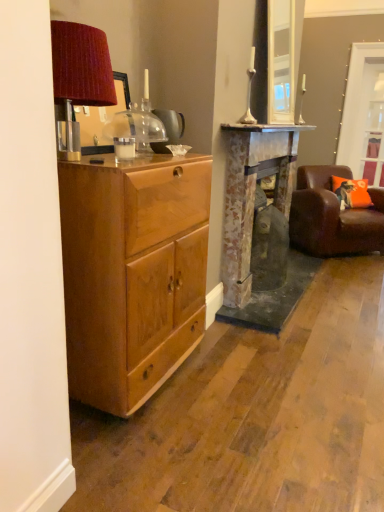
Question: Would you consider rustic stone fireplace at center to be distant from clear glass door at upper right?

Choices:
 (A) no
 (B) yes

Answer: (B)

Question: Does rustic stone fireplace at center lie behind clear glass door at upper right?

Choices:
 (A) no
 (B) yes

Answer: (A)

Question: Considering the relative sizes of rustic stone fireplace at center and clear glass door at upper right in the image provided, is rustic stone fireplace at center thinner than clear glass door at upper right?

Choices:
 (A) yes
 (B) no

Answer: (B)

Question: From the image's perspective, would you say rustic stone fireplace at center is shown under clear glass door at upper right?

Choices:
 (A) no
 (B) yes

Answer: (B)

Question: Is rustic stone fireplace at center next to clear glass door at upper right?

Choices:
 (A) yes
 (B) no

Answer: (B)

Question: From the image's perspective, is clear glass door at upper right located above or below brown leather chair at right?

Choices:
 (A) below
 (B) above

Answer: (B)

Question: Looking at their shapes, would you say clear glass door at upper right is wider or thinner than brown leather chair at right?

Choices:
 (A) thin
 (B) wide

Answer: (A)

Question: Which is correct: clear glass door at upper right is inside brown leather chair at right, or outside of it?

Choices:
 (A) outside
 (B) inside

Answer: (A)

Question: Looking at the image, does clear glass door at upper right seem bigger or smaller compared to brown leather chair at right?

Choices:
 (A) small
 (B) big

Answer: (A)

Question: From the image's perspective, is brown leather chair at right positioned above or below clear glass door at upper right?

Choices:
 (A) below
 (B) above

Answer: (A)

Question: Is point (322, 203) closer or farther from the camera than point (375, 147)?

Choices:
 (A) farther
 (B) closer

Answer: (B)

Question: Is brown leather chair at right in front of or behind clear glass door at upper right in the image?

Choices:
 (A) behind
 (B) front

Answer: (B)

Question: Based on their sizes in the image, would you say brown leather chair at right is bigger or smaller than clear glass door at upper right?

Choices:
 (A) big
 (B) small

Answer: (A)

Question: Based on their positions, is matte wood cabinet at left located to the left or right of clear glass door at upper right?

Choices:
 (A) left
 (B) right

Answer: (A)

Question: From a real-world perspective, is matte wood cabinet at left positioned above or below clear glass door at upper right?

Choices:
 (A) below
 (B) above

Answer: (A)